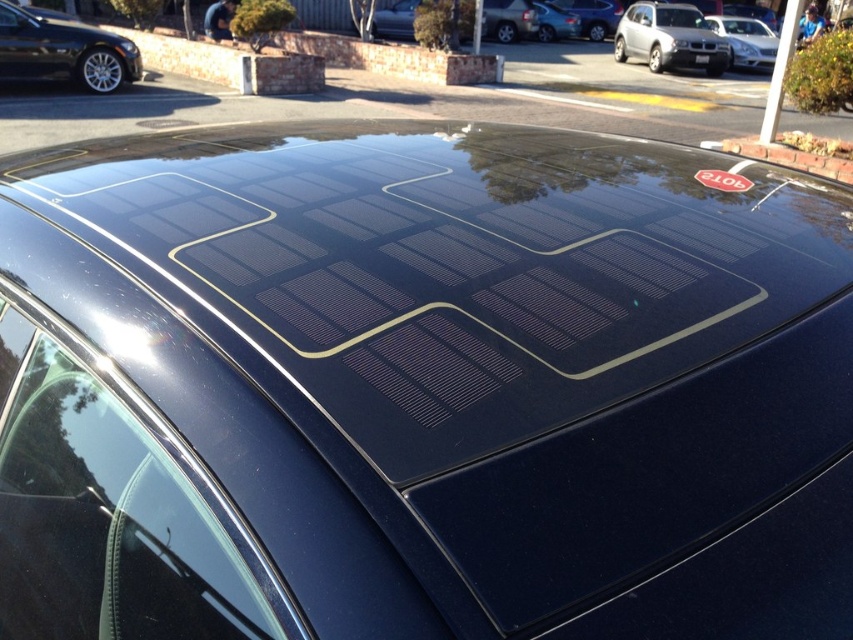
Between transparent glass windshield at lower left and satin silver sedan at upper right, which one has more height?

satin silver sedan at upper right is taller.

Does transparent glass windshield at lower left appear under satin silver sedan at upper right?

Indeed, transparent glass windshield at lower left is positioned under satin silver sedan at upper right.

Find the location of a particular element. The image size is (853, 640). transparent glass windshield at lower left is located at coordinates (111, 506).

Which is behind, point (767, 45) or point (398, 13)?

Positioned behind is point (398, 13).

Find the location of a particular element. This screenshot has height=640, width=853. satin silver sedan at upper right is located at coordinates click(746, 40).

The height and width of the screenshot is (640, 853). Describe the element at coordinates (746, 40) in the screenshot. I see `satin silver sedan at upper right` at that location.

I want to click on satin silver sedan at upper right, so click(x=746, y=40).

Does transparent glass windshield at lower left have a smaller size compared to glossy black solar panel at upper center?

Yes, transparent glass windshield at lower left is smaller than glossy black solar panel at upper center.

Where is `transparent glass windshield at lower left`? This screenshot has width=853, height=640. transparent glass windshield at lower left is located at coordinates (111, 506).

Where is `transparent glass windshield at lower left`? Image resolution: width=853 pixels, height=640 pixels. transparent glass windshield at lower left is located at coordinates (111, 506).